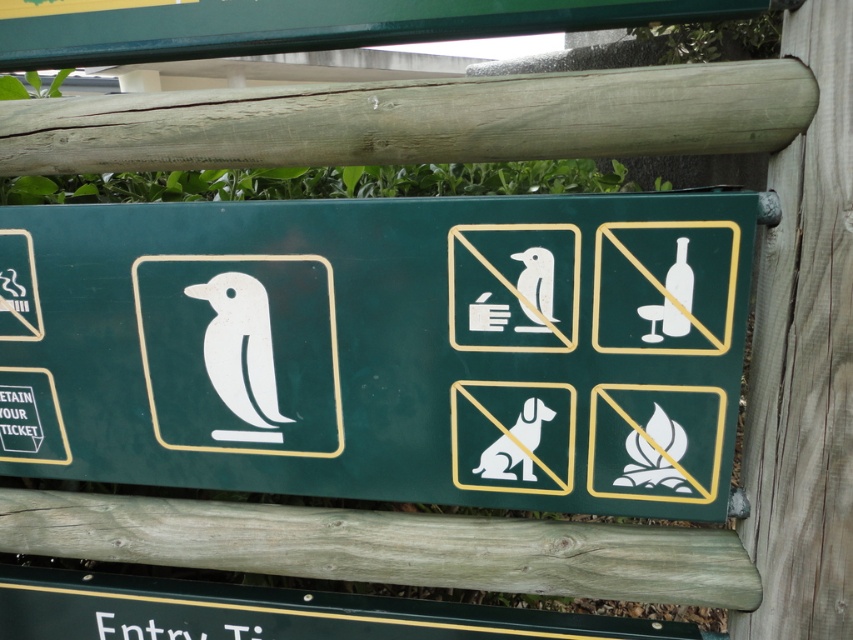
You are standing in front of the green signboard and want to touch both the weathered wood pole at upper center and the green matte sign at upper center. Which one should you reach for first if you want to touch the one closer to your right hand?

The weathered wood pole at upper center is to the right of green matte sign at upper center, so you should reach for the weathered wood pole at upper center first as it is on your right side.